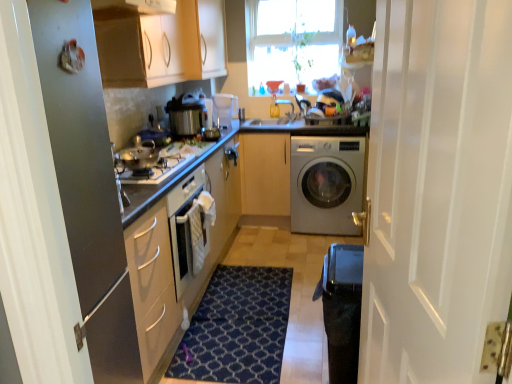
The height and width of the screenshot is (384, 512). Identify the location of free spot below dark blue textured rug at center (from a real-world perspective). (244, 312).